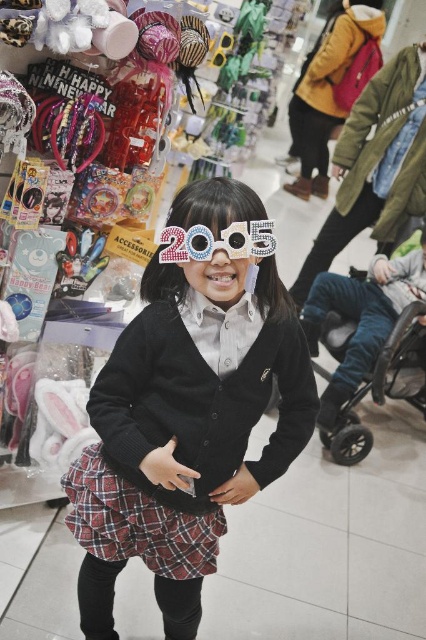
You are a customer in the store and want to know which of the items is larger between the black matte sweater at center and the shiny metallic goggles at center. Can you tell me?

The black matte sweater at center is bigger than the shiny metallic goggles at center.

Looking at this image, you are a store employee who needs to place a new accessory that is 30 inches long on the shelf. The plaid fabric skirt at center and the shiny metallic goggles at center are already on the shelf. Can the new accessory fit between them?

The plaid fabric skirt at center is 31.08 inches from the shiny metallic goggles at center. Since the new accessory is 30 inches long, it can fit between them as the distance between the two items is slightly larger than the accessory.

You are a customer in the store and want to see the shiny metallic goggles at center. However, the plaid fabric skirt at center is blocking your view. Can you move the skirt to get a better look at the goggles?

The shiny metallic goggles at center is behind the plaid fabric skirt at center, so you cannot see them directly. You would need to move the plaid fabric skirt at center to access or view the goggles.